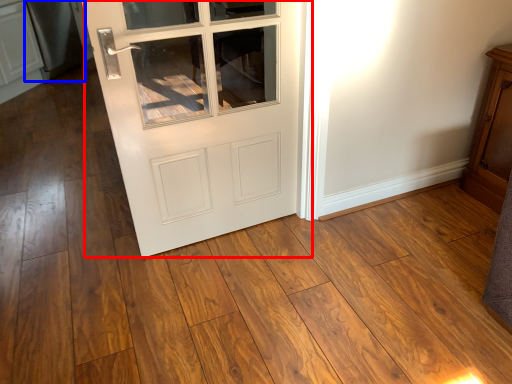
Question: Which object appears farthest to the camera in this image, door (highlighted by a red box) or appliance (highlighted by a blue box)?

Choices:
 (A) door
 (B) appliance

Answer: (B)